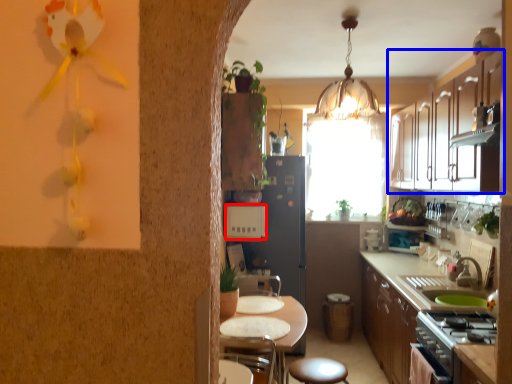
Question: Among these objects, which one is farthest to the camera, appliance (highlighted by a red box) or cabinetry (highlighted by a blue box)?

Choices:
 (A) appliance
 (B) cabinetry

Answer: (A)